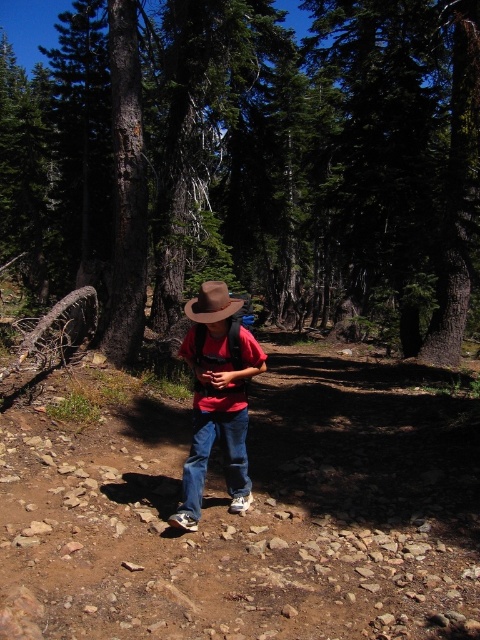
Question: Which point is closer to the camera taking this photo?

Choices:
 (A) (202, 456)
 (B) (86, 12)
 (C) (224, 360)
 (D) (210, 291)

Answer: (D)

Question: Where is denim at center located in relation to brown felt cowboy hat at center in the image?

Choices:
 (A) above
 (B) below

Answer: (B)

Question: Is brown bark tree at center thinner than matte red shirt at center?

Choices:
 (A) yes
 (B) no

Answer: (B)

Question: Which point appears farthest from the camera in this image?

Choices:
 (A) (195, 316)
 (B) (205, 400)
 (C) (315, 225)

Answer: (C)

Question: Based on their relative distances, which object is farther from the brown felt cowboy hat at center?

Choices:
 (A) matte red shirt at center
 (B) brown bark tree at center
 (C) denim at center

Answer: (B)

Question: Is denim at center to the left of brown felt cowboy hat at center from the viewer's perspective?

Choices:
 (A) yes
 (B) no

Answer: (B)